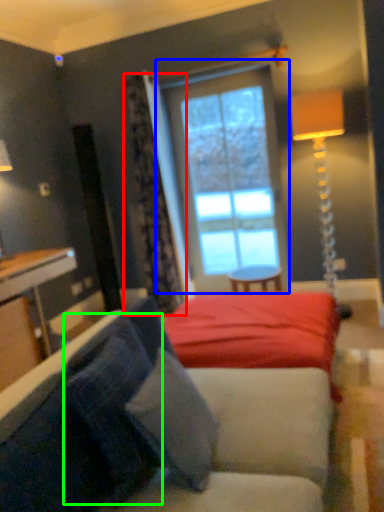
Question: Estimate the real-world distances between objects in this image. Which object is closer to curtain (highlighted by a red box), window (highlighted by a blue box) or pillow (highlighted by a green box)?

Choices:
 (A) window
 (B) pillow

Answer: (A)